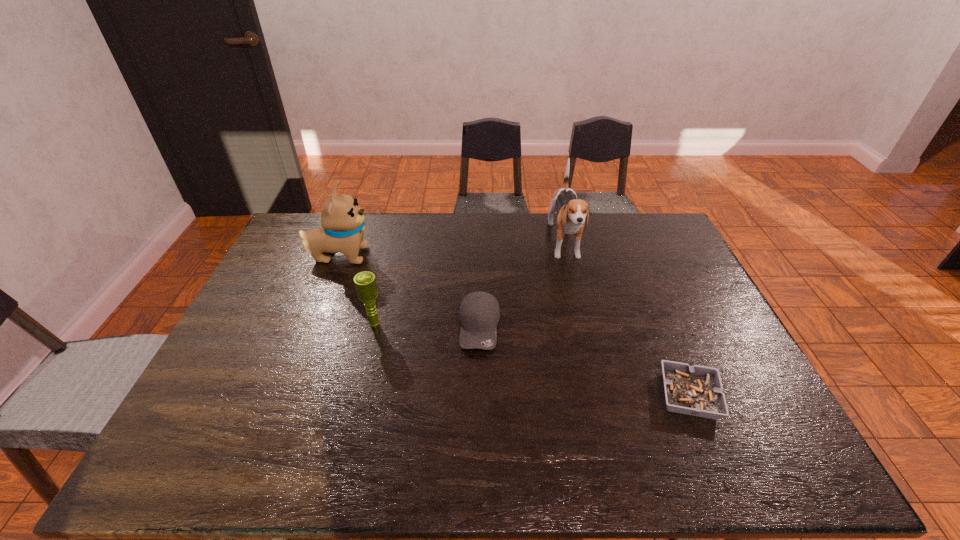
This screenshot has height=540, width=960. In order to click on free location located 0.190m on the front of the third tallest object in this screenshot , I will do `click(360, 387)`.

What are the coordinates of `free location located on the front brim of the baseball cap` in the screenshot? It's located at (480, 392).

You are a GUI agent. You are given a task and a screenshot of the screen. Output one action in this format:
    pyautogui.click(x=<x>, y=<y>)
    Task: Click on the free spot located 0.150m on the back of the nearest object
    
    Given the screenshot: What is the action you would take?
    pyautogui.click(x=660, y=327)

Locate an element on the screen. object that is at the left edge is located at coordinates [x=342, y=219].

Identify the location of object that is at the right edge. click(696, 390).

At what (x,y) coordinates should I click in order to perform the action: click on object that is at the far left corner. Please return your answer as a coordinate pair (x, y). The width and height of the screenshot is (960, 540). Looking at the image, I should click on (342, 219).

In the image, there is a desktop. What are the coordinates of `vacant region at the far edge` in the screenshot? It's located at (549, 246).

At what (x,y) coordinates should I click in order to perform the action: click on free region at the near edge of the desktop. Please return your answer as a coordinate pair (x, y). Looking at the image, I should click on (511, 454).

Locate an element on the screen. The height and width of the screenshot is (540, 960). free space at the left edge is located at coordinates (274, 313).

Identify the location of vacant space at the right edge. The height and width of the screenshot is (540, 960). (680, 315).